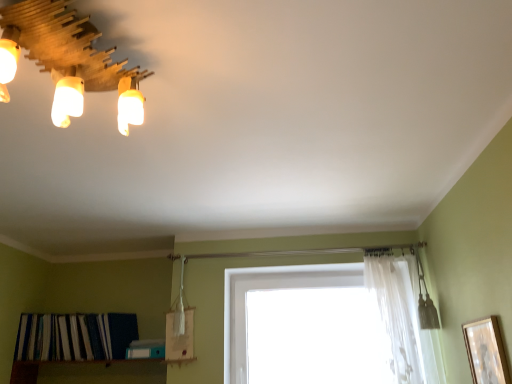
Question: From a real-world perspective, is white sheer curtain at upper center physically above transparent glass window at center?

Choices:
 (A) no
 (B) yes

Answer: (B)

Question: Is transparent glass window at center completely or partially inside white sheer curtain at upper center?

Choices:
 (A) yes
 (B) no

Answer: (B)

Question: Does white sheer curtain at upper center come in front of transparent glass window at center?

Choices:
 (A) no
 (B) yes

Answer: (B)

Question: From the image's perspective, is white sheer curtain at upper center on top of transparent glass window at center?

Choices:
 (A) yes
 (B) no

Answer: (A)

Question: Could you tell me if white sheer curtain at upper center is turned towards transparent glass window at center?

Choices:
 (A) no
 (B) yes

Answer: (A)

Question: From a real-world perspective, is white sheer curtain at upper center positioned above or below striped fabric at lower left?

Choices:
 (A) above
 (B) below

Answer: (A)

Question: Based on their sizes in the image, would you say white sheer curtain at upper center is bigger or smaller than striped fabric at lower left?

Choices:
 (A) small
 (B) big

Answer: (A)

Question: Considering the positions of white sheer curtain at upper center and striped fabric at lower left in the image, is white sheer curtain at upper center taller or shorter than striped fabric at lower left?

Choices:
 (A) tall
 (B) short

Answer: (A)

Question: From the image's perspective, is white sheer curtain at upper center above or below striped fabric at lower left?

Choices:
 (A) above
 (B) below

Answer: (A)

Question: Based on their sizes in the image, would you say transparent glass window at center is bigger or smaller than white sheer curtain at upper center?

Choices:
 (A) big
 (B) small

Answer: (A)

Question: From the image's perspective, relative to white sheer curtain at upper center, is transparent glass window at center above or below?

Choices:
 (A) above
 (B) below

Answer: (B)

Question: In terms of width, does transparent glass window at center look wider or thinner when compared to white sheer curtain at upper center?

Choices:
 (A) wide
 (B) thin

Answer: (B)

Question: Is transparent glass window at center to the left or to the right of white sheer curtain at upper center in the image?

Choices:
 (A) right
 (B) left

Answer: (B)

Question: Is transparent glass window at center situated inside wooden light fixture at upper left or outside?

Choices:
 (A) outside
 (B) inside

Answer: (A)

Question: Is transparent glass window at center bigger or smaller than wooden light fixture at upper left?

Choices:
 (A) small
 (B) big

Answer: (B)